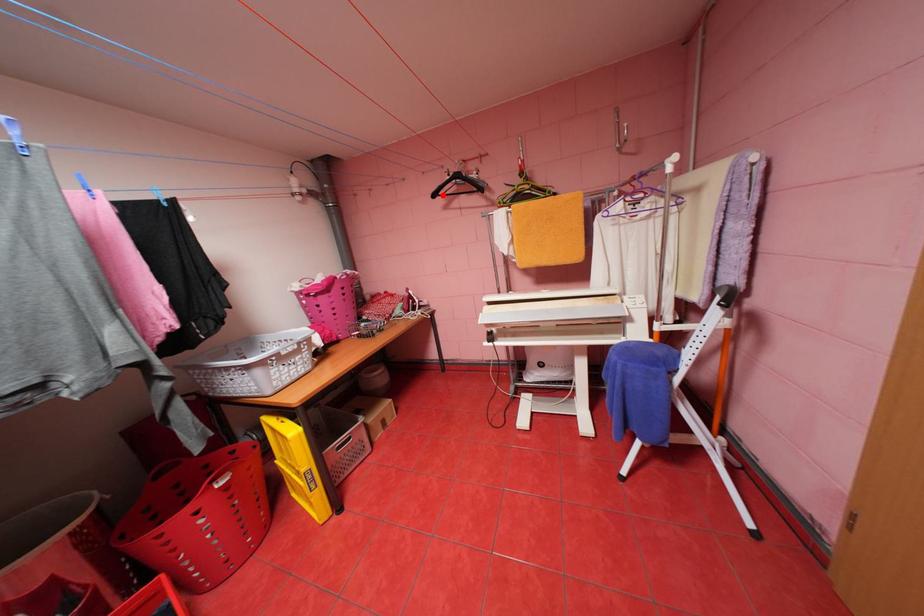
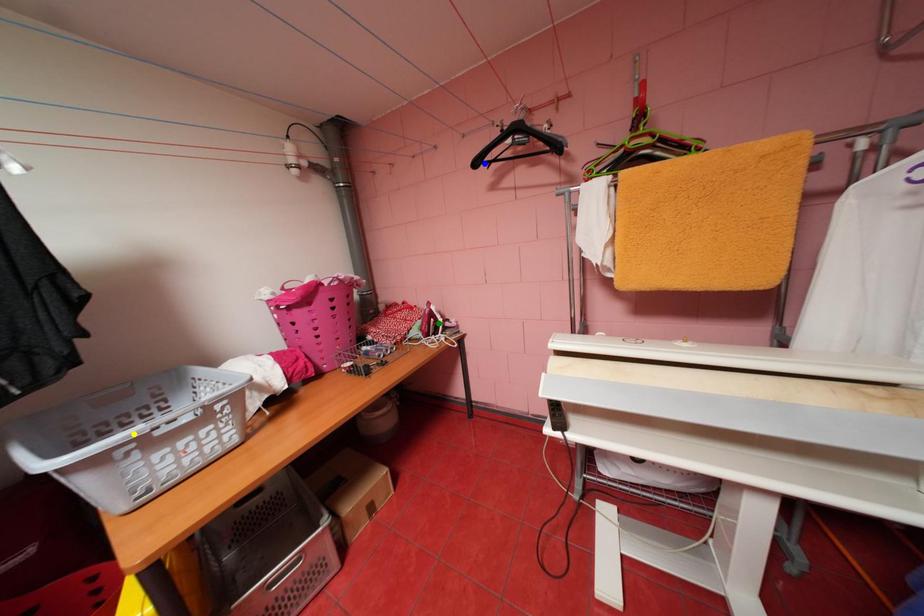
Question: I am providing you with two images of the same scene from different viewpoints. A red point is marked on the first image. You are given multiple points on the second image. Can you choose the point in image 2 that corresponds to the point in image 1?

Choices:
 (A) yellow point
 (B) blue point
 (C) green point

Answer: (B)